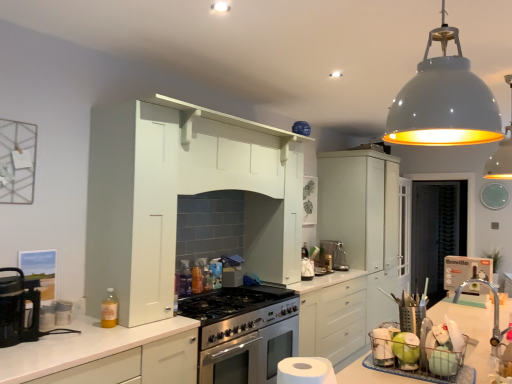
Question: Which direction should I rotate to face white matte dome at upper center, which ranks as the 1th light fixture in back-to-front order, — up or down?

Choices:
 (A) down
 (B) up

Answer: (B)

Question: Is satin silver kettle at center positioned with its back to white glossy pendant lamp at upper right, marked as the 2th light fixture in a back-to-front arrangement?

Choices:
 (A) yes
 (B) no

Answer: (B)

Question: Considering the relative sizes of satin silver kettle at center and white glossy pendant lamp at upper right, the 1th light fixture viewed from the left, in the image provided, is satin silver kettle at center thinner than white glossy pendant lamp at upper right, the 1th light fixture viewed from the left,?

Choices:
 (A) no
 (B) yes

Answer: (B)

Question: Does satin silver kettle at center appear on the left side of white glossy pendant lamp at upper right, the 1th light fixture viewed from the left?

Choices:
 (A) no
 (B) yes

Answer: (A)

Question: Does satin silver kettle at center lie behind white glossy pendant lamp at upper right, the 1th light fixture viewed from the left?

Choices:
 (A) yes
 (B) no

Answer: (A)

Question: Considering the relative sizes of satin silver kettle at center and white glossy pendant lamp at upper right, which is counted as the second light fixture, starting from the right, in the image provided, is satin silver kettle at center smaller than white glossy pendant lamp at upper right, which is counted as the second light fixture, starting from the right,?

Choices:
 (A) no
 (B) yes

Answer: (B)

Question: Considering the relative sizes of satin silver kettle at center and white glossy pendant lamp at upper right, which is counted as the second light fixture, starting from the right, in the image provided, is satin silver kettle at center taller than white glossy pendant lamp at upper right, which is counted as the second light fixture, starting from the right,?

Choices:
 (A) yes
 (B) no

Answer: (B)

Question: Considering the relative positions of satin silver kettle at center and white matte cabinet at lower left, which is counted as the first cabinetry, starting from the front, in the image provided, is satin silver kettle at center to the left of white matte cabinet at lower left, which is counted as the first cabinetry, starting from the front, from the viewer's perspective?

Choices:
 (A) no
 (B) yes

Answer: (A)

Question: Is satin silver kettle at center further to the viewer compared to white matte cabinet at lower left, which ranks as the 1th cabinetry in left-to-right order?

Choices:
 (A) no
 (B) yes

Answer: (B)

Question: Is satin silver kettle at center far from white matte cabinet at lower left, which is counted as the first cabinetry, starting from the front?

Choices:
 (A) no
 (B) yes

Answer: (B)

Question: Does satin silver kettle at center have a larger size compared to white matte cabinet at lower left, which ranks as the 1th cabinetry in left-to-right order?

Choices:
 (A) no
 (B) yes

Answer: (A)

Question: Is satin silver kettle at center aimed at white matte cabinet at lower left, which ranks as the 1th cabinetry in left-to-right order?

Choices:
 (A) yes
 (B) no

Answer: (B)

Question: Considering the relative sizes of satin silver kettle at center and white matte cabinet at lower left, which is the 2th cabinetry from back to front, in the image provided, is satin silver kettle at center shorter than white matte cabinet at lower left, which is the 2th cabinetry from back to front,?

Choices:
 (A) no
 (B) yes

Answer: (B)

Question: Is satin silver coffee machine at center to the right of white matte cabinet at lower left, the second cabinetry from the right, from the viewer's perspective?

Choices:
 (A) no
 (B) yes

Answer: (B)